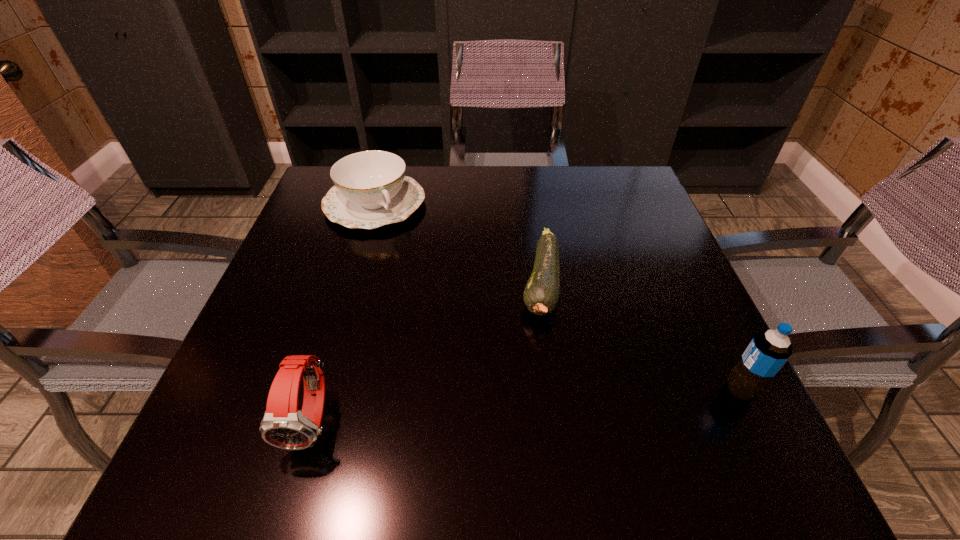
Locate an element on the screen. The image size is (960, 540). object present at the near left corner is located at coordinates (283, 426).

This screenshot has width=960, height=540. In order to click on object that is at the near right corner in this screenshot , I will do `click(768, 351)`.

Locate an element on the screen. vacant area at the far edge is located at coordinates (473, 181).

Image resolution: width=960 pixels, height=540 pixels. What are the coordinates of `vacant space at the near edge of the desktop` in the screenshot? It's located at (406, 409).

This screenshot has height=540, width=960. Identify the location of vacant area at the left edge. (320, 354).

Where is `vacant space at the right edge`? This screenshot has height=540, width=960. vacant space at the right edge is located at coordinates (677, 289).

Where is `free space at the near right corner`? This screenshot has width=960, height=540. free space at the near right corner is located at coordinates (663, 410).

At what (x,y) coordinates should I click in order to perform the action: click on free space between the farthest object and the second tallest object. Please return your answer as a coordinate pair (x, y). This screenshot has height=540, width=960. Looking at the image, I should click on (345, 312).

Identify the location of vacant area that lies between the third shortest object and the rightmost object. This screenshot has height=540, width=960. (527, 405).

At what (x,y) coordinates should I click in order to perform the action: click on free space between the watch and the tallest object. Please return your answer as a coordinate pair (x, y). Looking at the image, I should click on (527, 405).